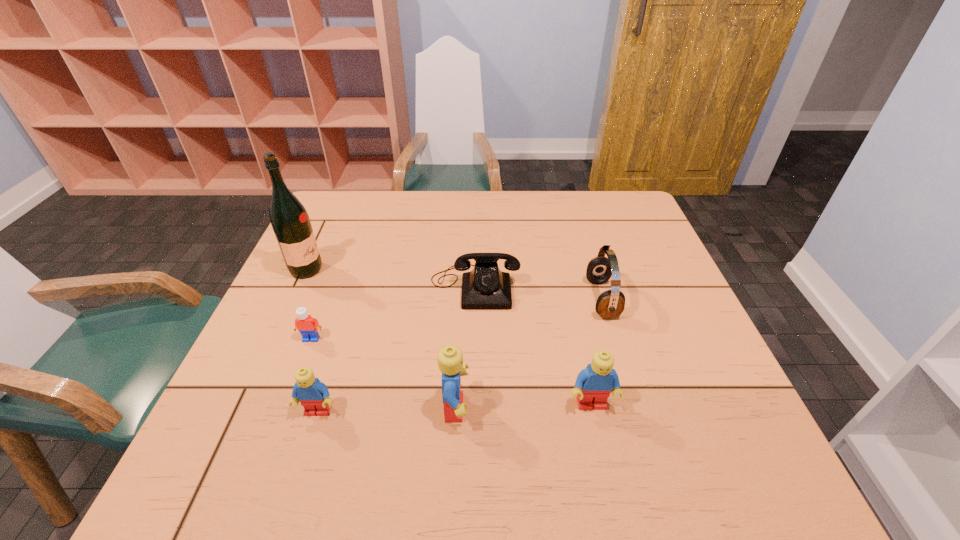
Locate an element on the screen. vacant place for an extra Lego on the right is located at coordinates (726, 401).